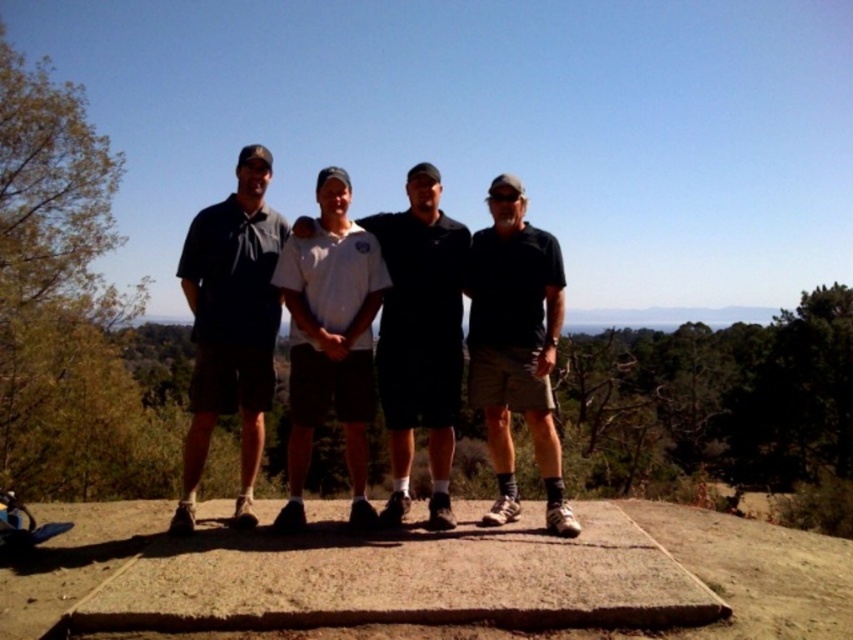
Question: Can you confirm if white cotton shirt at center is positioned above black cotton shirt at right?

Choices:
 (A) no
 (B) yes

Answer: (A)

Question: Is white cotton shirt at center bigger than black cotton shirt at right?

Choices:
 (A) yes
 (B) no

Answer: (A)

Question: In this image, where is dark gray fabric shirt at left located relative to black cotton shirt at right?

Choices:
 (A) below
 (B) above

Answer: (A)

Question: Considering the real-world distances, which object is closest to the dark gray fabric shirt at left?

Choices:
 (A) white cotton shirt at center
 (B) black cotton shirt at right

Answer: (A)

Question: Which object is positioned farthest from the white cotton shirt at center?

Choices:
 (A) black cotton shirt at right
 (B) dark gray fabric shirt at left

Answer: (B)

Question: Which point is closer to the camera?

Choices:
 (A) [x=469, y=272]
 (B) [x=247, y=513]

Answer: (B)